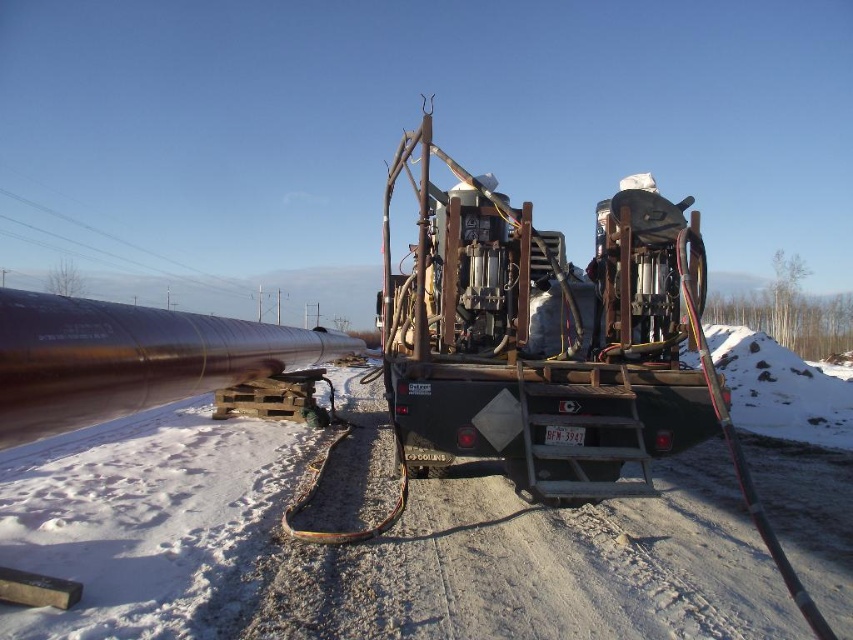
Question: Can you confirm if white powdery snow at center is positioned above metallic brown trailer truck at center?

Choices:
 (A) yes
 (B) no

Answer: (B)

Question: Can you confirm if white powdery snow at center is bigger than metallic brown trailer truck at center?

Choices:
 (A) no
 (B) yes

Answer: (B)

Question: Is white powdery snow at center below metallic brown trailer truck at center?

Choices:
 (A) no
 (B) yes

Answer: (B)